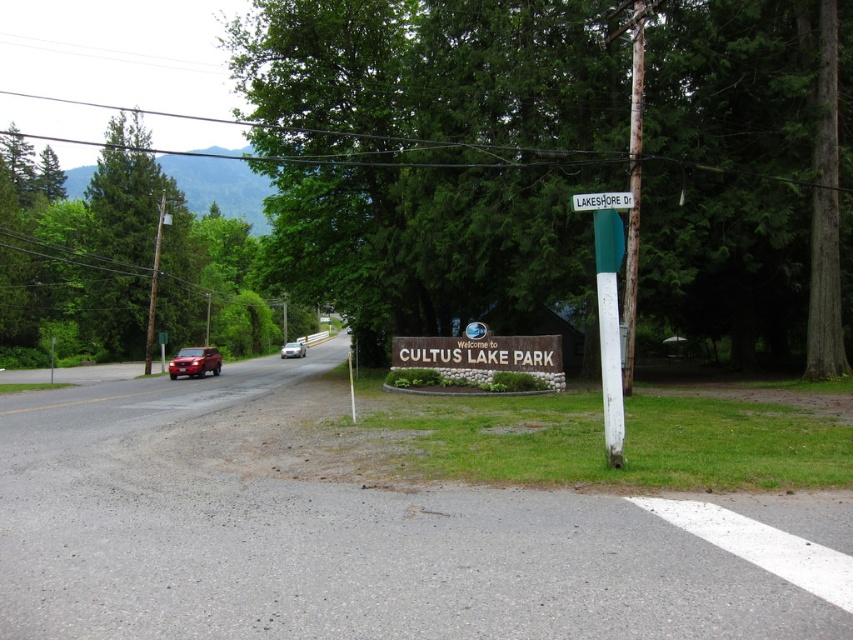
You are standing at the camera position and want to walk to both points. Which point should you reach first, point (607, 401) or point (590, 202)?

You should reach point (607, 401) first because it is closer to the camera than point (590, 202).

You are a pedestrian standing at the edge of the road. You see the brown wooden sign at center and the matte red suv at left. Which object is nearer to you?

The brown wooden sign at center is closer to the viewer than the matte red suv at left, so the brown wooden sign at center is nearer to you.

Based on the photo, you are a visitor driving into Cultus Lake Park and see the brown wooden sign at center and the white plastic street sign at upper center. Which sign is shorter?

The brown wooden sign at center is shorter than the white plastic street sign at upper center.